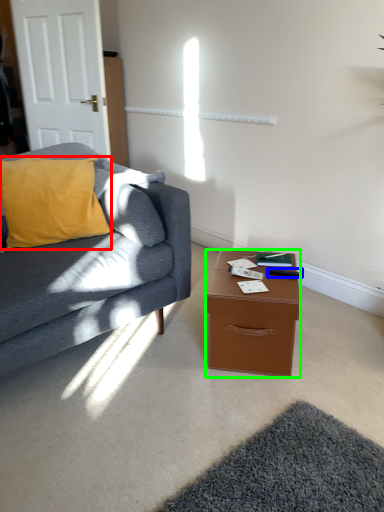
Question: Based on their relative distances, which object is nearer to pillow (highlighted by a red box)? Choose from remote control (highlighted by a blue box) and desk (highlighted by a green box).

Choices:
 (A) remote control
 (B) desk

Answer: (B)